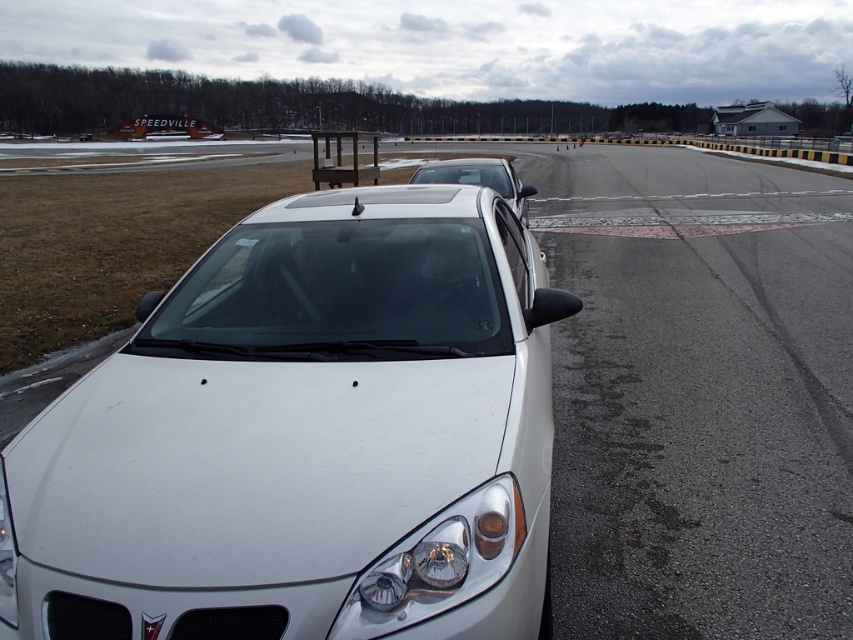
You are a mechanic who needs to access the engine compartment of the satin white sedan at center. The glossy plastic headlight at center is blocking your path. Can you safely walk around the headlight to reach the sedan without getting too close to the track?

The distance between the glossy plastic headlight at center and the satin white sedan at center is 3.96 meters. Since this distance is sufficient to walk around safely, you can move around the headlight to reach the sedan while maintaining a safe distance from the track.

You are a photographer trying to capture the white glossy sedan at center and the satin white sedan at center. Since both are at the center, how can you distinguish which one is in front?

The white glossy sedan at center is positioned under the satin white sedan at center, so the satin white sedan at center is in front.